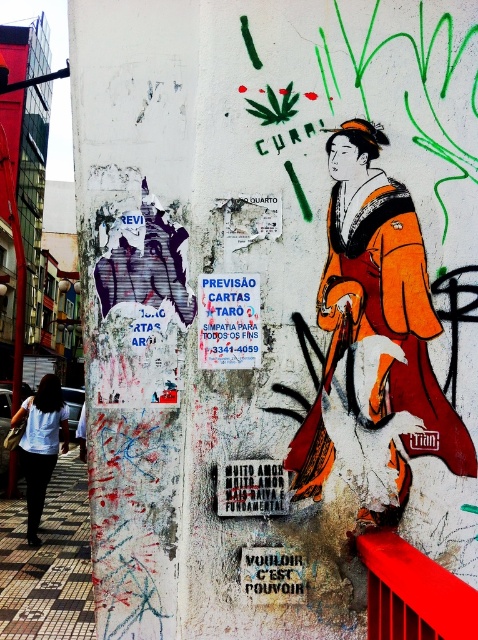
Can you confirm if smooth metal rail at lower right is taller than white cotton shirt at lower left?

No.

Which is behind, point (448, 612) or point (23, 413)?

The point (23, 413) is behind.

Locate an element on the screen. smooth metal rail at lower right is located at coordinates (412, 593).

Is orange silk kimono at center above smooth metal rail at lower right?

Yes.

The image size is (478, 640). Find the location of `orange silk kimono at center`. orange silk kimono at center is located at coordinates click(x=377, y=332).

Can you confirm if orange silk kimono at center is positioned below white cotton shirt at lower left?

No.

Which is behind, point (314, 428) or point (33, 436)?

Positioned behind is point (33, 436).

Identify the location of orange silk kimono at center. (377, 332).